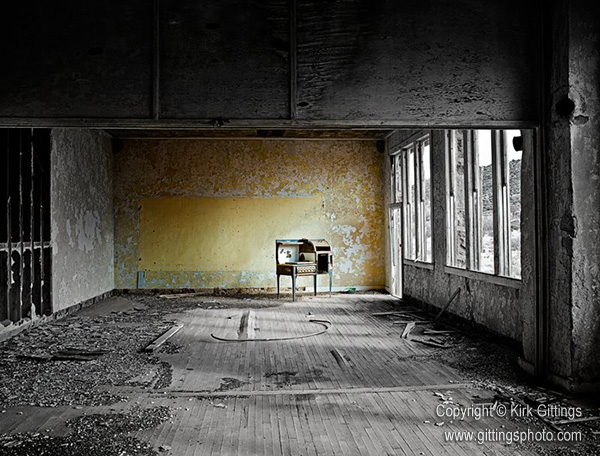
Find the location of `back yellow/gray wall`. back yellow/gray wall is located at coordinates (232, 206).